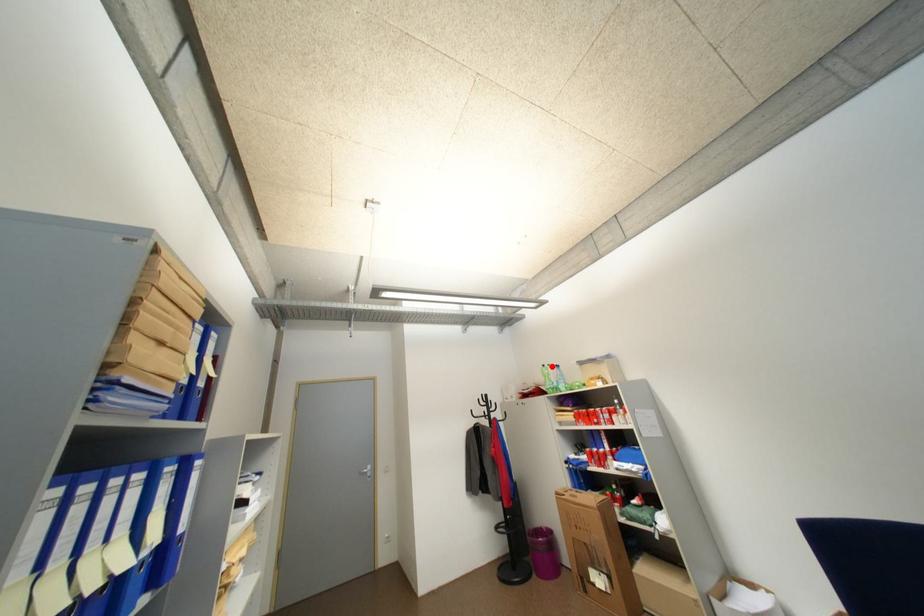
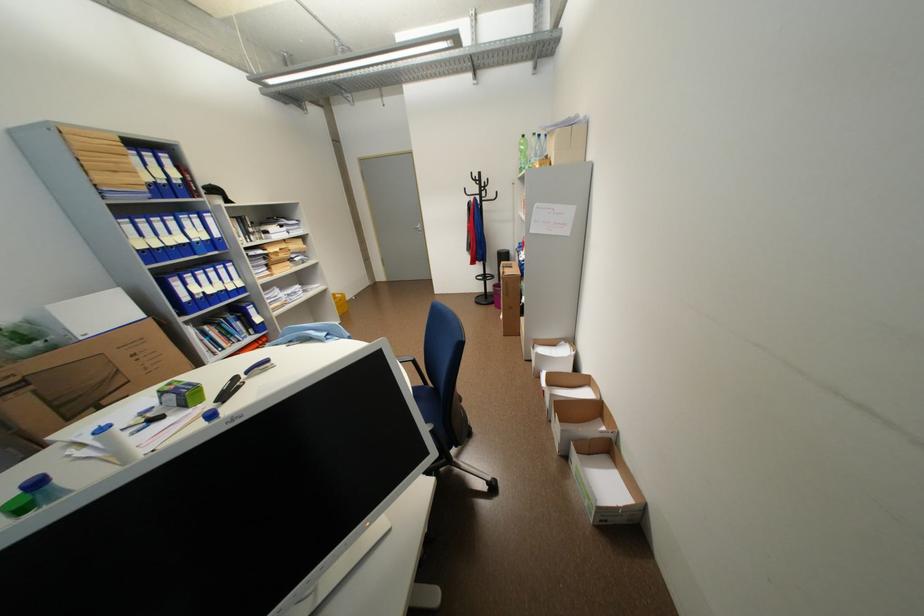
Where in the second image is the point corresponding to the highlighted location from the first image?

(531, 137)